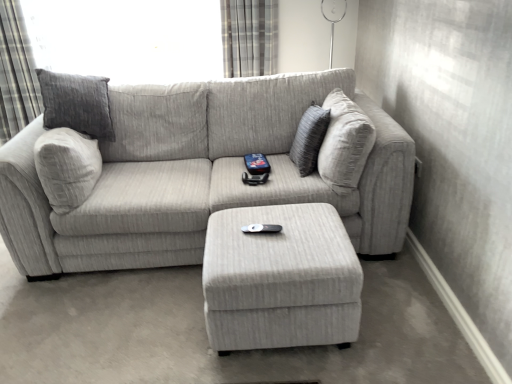
Question: Does light gray fabric ottoman at center have a greater height compared to textured gray pillow at center?

Choices:
 (A) yes
 (B) no

Answer: (B)

Question: Is light gray fabric ottoman at center bigger than textured gray pillow at center?

Choices:
 (A) no
 (B) yes

Answer: (B)

Question: From the image's perspective, is light gray fabric ottoman at center below textured gray pillow at center?

Choices:
 (A) yes
 (B) no

Answer: (A)

Question: From a real-world perspective, is light gray fabric ottoman at center located higher than textured gray pillow at center?

Choices:
 (A) no
 (B) yes

Answer: (A)

Question: Is light gray fabric ottoman at center smaller than textured gray pillow at center?

Choices:
 (A) no
 (B) yes

Answer: (A)

Question: Can you confirm if light gray fabric ottoman at center is thinner than textured gray pillow at center?

Choices:
 (A) yes
 (B) no

Answer: (B)

Question: From the image's perspective, is textured gray pillow at center on gray textured curtain at upper left, which is the 1th curtain in left-to-right order?

Choices:
 (A) yes
 (B) no

Answer: (B)

Question: Is textured gray pillow at center not close to gray textured curtain at upper left, the 2th curtain positioned from the right?

Choices:
 (A) no
 (B) yes

Answer: (B)

Question: Considering the relative positions of textured gray pillow at center and gray textured curtain at upper left, the 2th curtain positioned from the right, in the image provided, is textured gray pillow at center to the left of gray textured curtain at upper left, the 2th curtain positioned from the right, from the viewer's perspective?

Choices:
 (A) no
 (B) yes

Answer: (A)

Question: Can you confirm if textured gray pillow at center is bigger than gray textured curtain at upper left, the 2th curtain positioned from the right?

Choices:
 (A) yes
 (B) no

Answer: (B)

Question: Can you confirm if textured gray pillow at center is shorter than gray textured curtain at upper left, the 2th curtain positioned from the right?

Choices:
 (A) yes
 (B) no

Answer: (A)

Question: Does textured gray pillow at center appear on the right side of gray textured curtain at upper left, the 2th curtain positioned from the right?

Choices:
 (A) yes
 (B) no

Answer: (A)

Question: Does gray textured curtain at upper left, the 2th curtain positioned from the right, come in front of plaid fabric curtain at upper center, placed as the 2th curtain when sorted from left to right?

Choices:
 (A) yes
 (B) no

Answer: (A)